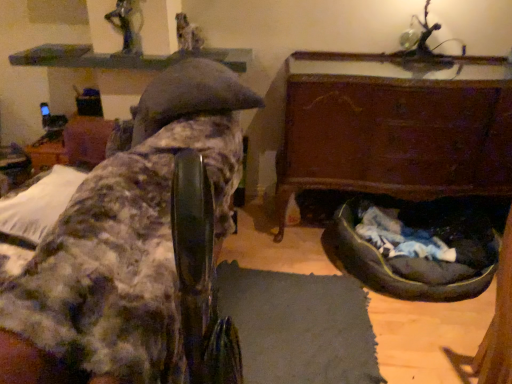
Question: Visually, is metallic statue at upper center, arranged as the 1th person when viewed from the front, positioned to the left or to the right of dark gray fabric dog bed at lower right?

Choices:
 (A) left
 (B) right

Answer: (A)

Question: Relative to dark gray fabric dog bed at lower right, is metallic statue at upper center, acting as the 2th person starting from the right, in front or behind?

Choices:
 (A) behind
 (B) front

Answer: (A)

Question: Which object is positioned closest to the smooth gray statue at upper center, which is the 1th person in back-to-front order?

Choices:
 (A) dark gray fabric dog bed at lower right
 (B) wooden chest at lower right, the 2th furniture positioned from the left
 (C) fuzzy fabric chair at upper left, which ranks as the second furniture in right-to-left order
 (D) metallic statue at upper center, the second person when ordered from back to front

Answer: (D)

Question: Which is nearer to the wooden chest at lower right, the 2th furniture positioned from the left?

Choices:
 (A) metallic statue at upper center, acting as the 2th person starting from the right
 (B) dark gray fabric dog bed at lower right
 (C) fuzzy fabric chair at upper left, which ranks as the 1th furniture in left-to-right order
 (D) smooth gray statue at upper center, which is the second person in front-to-back order

Answer: (B)